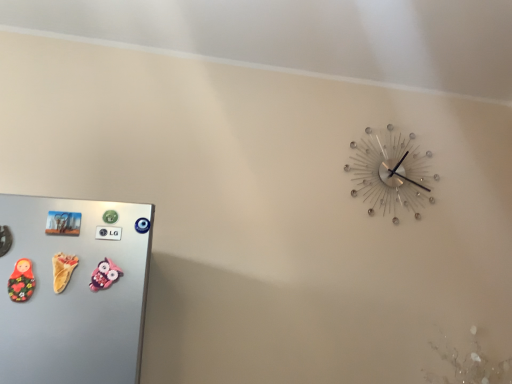
Question: Does matte wooden doll at left, which is counted as the first toy, starting from the left, have a larger size compared to pink fabric owl at lower left, which is the 3th toy in left-to-right order?

Choices:
 (A) no
 (B) yes

Answer: (B)

Question: Is matte wooden doll at left, which is counted as the first toy, starting from the left, outside pink fabric owl at lower left, the 1th toy in the right-to-left sequence?

Choices:
 (A) no
 (B) yes

Answer: (B)

Question: Is matte wooden doll at left, which ranks as the third toy in right-to-left order, at the right side of pink fabric owl at lower left, which is the 3th toy in left-to-right order?

Choices:
 (A) yes
 (B) no

Answer: (B)

Question: Is matte wooden doll at left, which ranks as the third toy in right-to-left order, not close to pink fabric owl at lower left, which is the 3th toy in left-to-right order?

Choices:
 (A) no
 (B) yes

Answer: (A)

Question: Is matte wooden doll at left, which ranks as the third toy in right-to-left order, shorter than pink fabric owl at lower left, the 1th toy in the right-to-left sequence?

Choices:
 (A) no
 (B) yes

Answer: (A)

Question: Visually, is yellow rubber duck at left, which is the 2th toy in right-to-left order, positioned to the left or to the right of matte wooden doll at left, which is counted as the first toy, starting from the left?

Choices:
 (A) right
 (B) left

Answer: (A)

Question: Is yellow rubber duck at left, which is the 2th toy in right-to-left order, situated inside matte wooden doll at left, which is counted as the first toy, starting from the left, or outside?

Choices:
 (A) outside
 (B) inside

Answer: (A)

Question: From the image's perspective, is yellow rubber duck at left, which is the 2th toy in right-to-left order, positioned above or below matte wooden doll at left, which ranks as the third toy in right-to-left order?

Choices:
 (A) below
 (B) above

Answer: (B)

Question: Relative to matte wooden doll at left, which is counted as the first toy, starting from the left, is yellow rubber duck at left, marked as the second toy in a left-to-right arrangement, in front or behind?

Choices:
 (A) front
 (B) behind

Answer: (B)

Question: From a real-world perspective, is matte wooden doll at left, which is counted as the first toy, starting from the left, physically located above or below metallic silver clock at upper right?

Choices:
 (A) below
 (B) above

Answer: (A)

Question: Considering the positions of matte wooden doll at left, which is counted as the first toy, starting from the left, and metallic silver clock at upper right in the image, is matte wooden doll at left, which is counted as the first toy, starting from the left, wider or thinner than metallic silver clock at upper right?

Choices:
 (A) wide
 (B) thin

Answer: (B)

Question: Looking at the image, does matte wooden doll at left, which ranks as the third toy in right-to-left order, seem bigger or smaller compared to metallic silver clock at upper right?

Choices:
 (A) small
 (B) big

Answer: (A)

Question: Is matte wooden doll at left, which is counted as the first toy, starting from the left, inside or outside of metallic silver clock at upper right?

Choices:
 (A) outside
 (B) inside

Answer: (A)

Question: Considering the positions of metallic silver clock at upper right and matte wooden doll at left, which ranks as the third toy in right-to-left order, in the image, is metallic silver clock at upper right bigger or smaller than matte wooden doll at left, which ranks as the third toy in right-to-left order,?

Choices:
 (A) small
 (B) big

Answer: (B)

Question: From the image's perspective, is metallic silver clock at upper right above or below matte wooden doll at left, which ranks as the third toy in right-to-left order?

Choices:
 (A) below
 (B) above

Answer: (B)